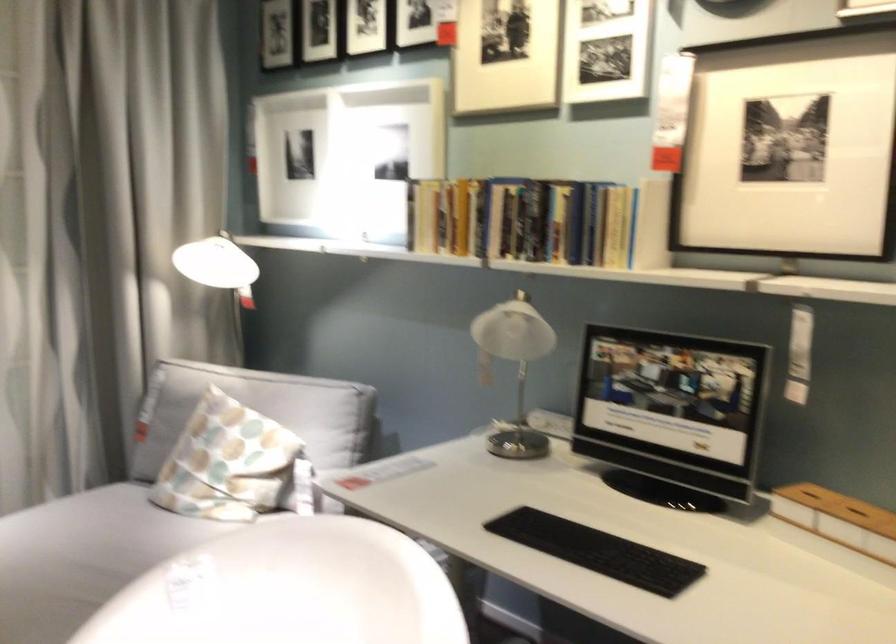
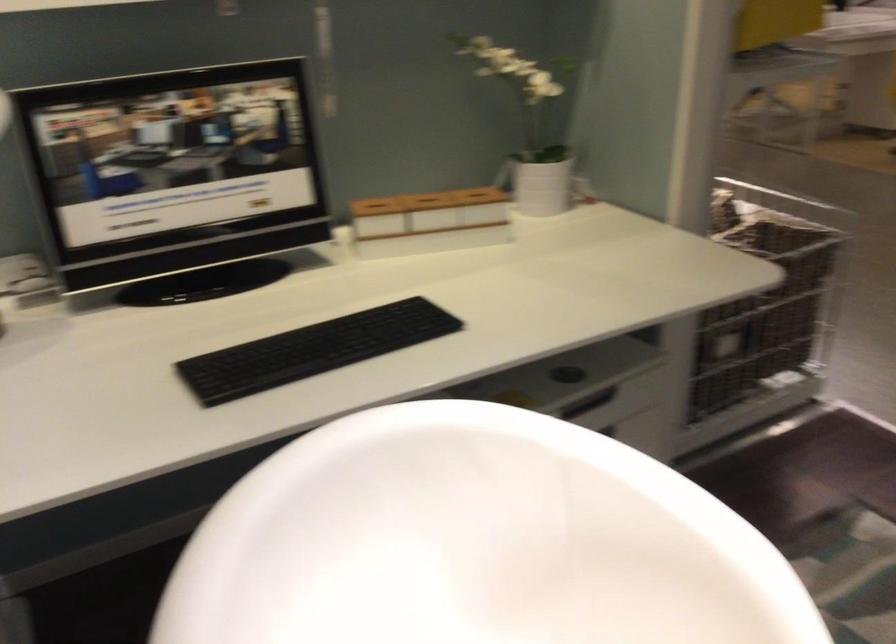
Find the pixel in the second image that matches the point at 808,489 in the first image.

(375, 204)